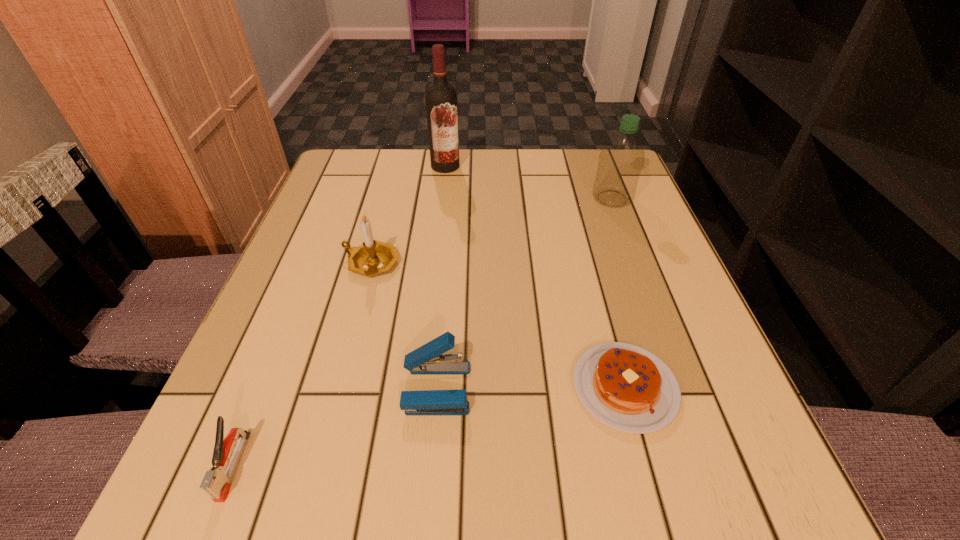
Locate an element on the screen. water bottle positioned at the right edge is located at coordinates (621, 159).

I want to click on pancake that is at the right edge, so click(x=626, y=387).

Where is `object that is at the near left corner`? This screenshot has height=540, width=960. object that is at the near left corner is located at coordinates (216, 483).

The image size is (960, 540). Identify the location of object that is at the far right corner. (621, 159).

This screenshot has height=540, width=960. Find the location of `free space at the far edge of the desktop`. free space at the far edge of the desktop is located at coordinates (422, 194).

The height and width of the screenshot is (540, 960). Find the location of `free space at the near edge`. free space at the near edge is located at coordinates (423, 463).

Image resolution: width=960 pixels, height=540 pixels. What are the coordinates of `vacant space at the left edge` in the screenshot? It's located at (338, 300).

At what (x,y) coordinates should I click in order to perform the action: click on vacant area at the right edge. Please return your answer as a coordinate pair (x, y). Looking at the image, I should click on (581, 210).

Find the location of a particular element. free spot at the far left corner of the desktop is located at coordinates (389, 158).

Where is `vacant region at the near right corner of the desktop`? The height and width of the screenshot is (540, 960). vacant region at the near right corner of the desktop is located at coordinates (682, 500).